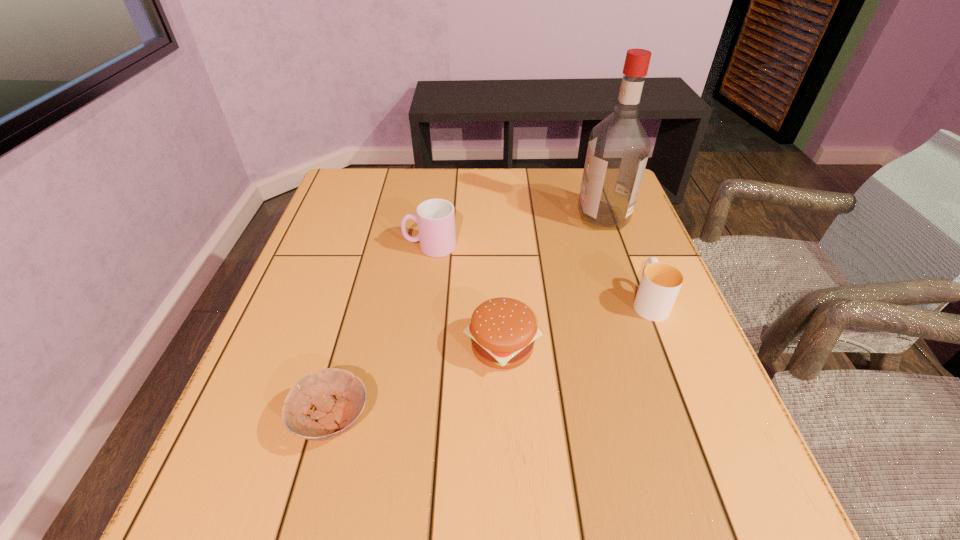
Where is `free space that satisfies the following two spatial constraints: 1. on the front-facing side of the tallest object; 2. with the handle on the side of the nearer cup`? free space that satisfies the following two spatial constraints: 1. on the front-facing side of the tallest object; 2. with the handle on the side of the nearer cup is located at coordinates (632, 301).